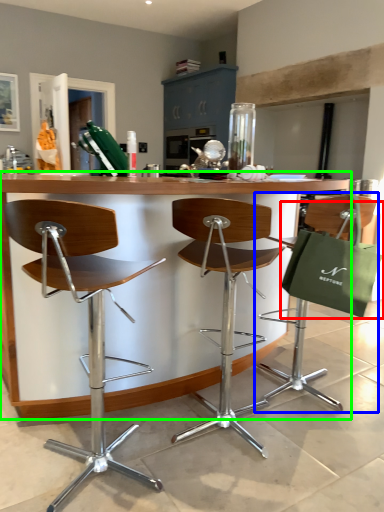
Question: Which is nearer to the shopping bag (highlighted by a red box)? chair (highlighted by a blue box) or table (highlighted by a green box).

Choices:
 (A) chair
 (B) table

Answer: (A)